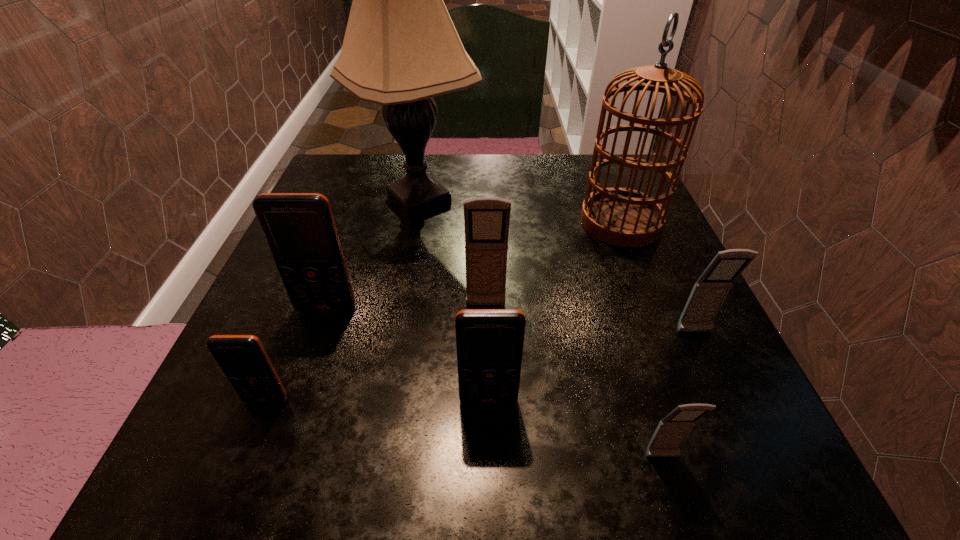
Locate an element on the screen. unoccupied area between the rightmost orange cellular telephone and the biggest orange cellular telephone is located at coordinates (408, 354).

Point out which object is positioned as the nearest to the leftmost gray cellular telephone. Please provide its 2D coordinates. Your answer should be formatted as a tuple, i.e. [(x, y)], where the tuple contains the x and y coordinates of a point satisfying the conditions above.

[(489, 342)]

Select which object appears as the third closest to the second biggest orange cellular telephone. Please provide its 2D coordinates. Your answer should be formatted as a tuple, i.e. [(x, y)], where the tuple contains the x and y coordinates of a point satisfying the conditions above.

[(299, 228)]

Where is `cellular telephone that stands as the fourth closest to the lamp`? The height and width of the screenshot is (540, 960). cellular telephone that stands as the fourth closest to the lamp is located at coordinates (242, 358).

Locate an element on the screen. cellular telephone that stands as the sixth closest to the tallest object is located at coordinates (671, 432).

In order to click on gray cellular telephone object that ranks as the second closest to the tallest object in this screenshot , I will do `click(709, 292)`.

The width and height of the screenshot is (960, 540). What are the coordinates of `gray cellular telephone that stands as the third closest to the farthest orange cellular telephone` in the screenshot? It's located at (709, 292).

Point out which orange cellular telephone is positioned as the nearest to the biggest orange cellular telephone. Please provide its 2D coordinates. Your answer should be formatted as a tuple, i.e. [(x, y)], where the tuple contains the x and y coordinates of a point satisfying the conditions above.

[(242, 358)]

Identify which orange cellular telephone is the closest to the birdcage. Please provide its 2D coordinates. Your answer should be formatted as a tuple, i.e. [(x, y)], where the tuple contains the x and y coordinates of a point satisfying the conditions above.

[(489, 342)]